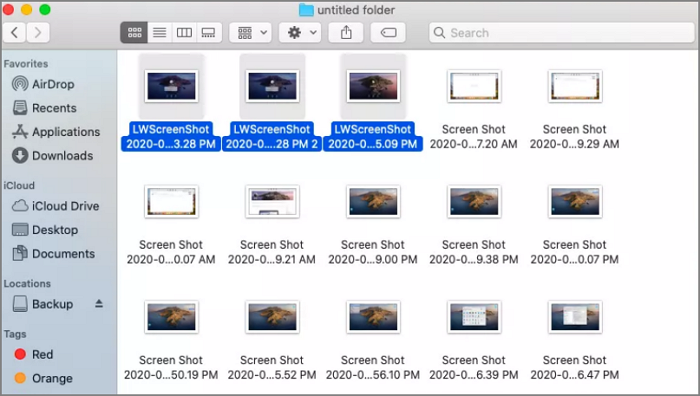
This screenshot has width=700, height=396. Identify the location of desktop. (36, 229), (43, 229), (52, 228), (57, 228), (60, 228), (66, 228), (73, 228).